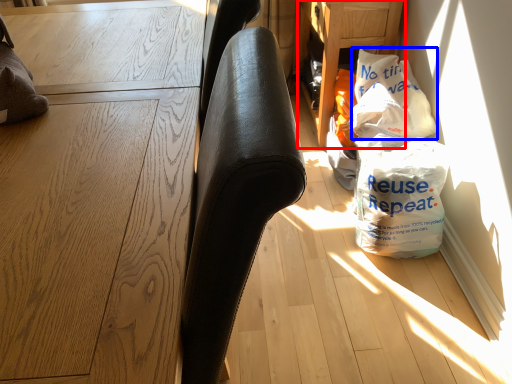
Question: Which point is closer to the camera, table (highlighted by a red box) or grocery bag (highlighted by a blue box)?

Choices:
 (A) table
 (B) grocery bag

Answer: (B)